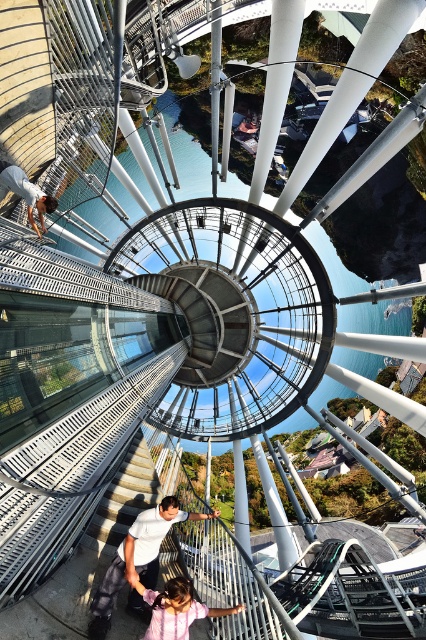
Question: Which point appears farthest from the camera in this image?

Choices:
 (A) (22, 189)
 (B) (175, 512)
 (C) (158, 637)
 (D) (120, 465)

Answer: (A)

Question: Among these points, which one is nearest to the camera?

Choices:
 (A) (135, 588)
 (B) (89, 532)
 (C) (5, 176)

Answer: (A)

Question: Can you confirm if metallic gray staircase at center is smaller than pink matte dress at lower center?

Choices:
 (A) yes
 (B) no

Answer: (B)

Question: Is white matte shirt at center wider than pink matte dress at lower center?

Choices:
 (A) no
 (B) yes

Answer: (B)

Question: Which of these objects is positioned farthest from the white matte shirt at center?

Choices:
 (A) pink matte dress at lower center
 (B) matte white shirt at lower left
 (C) metallic gray staircase at center

Answer: (B)

Question: Does metallic gray staircase at center lie behind matte white shirt at lower left?

Choices:
 (A) yes
 (B) no

Answer: (B)